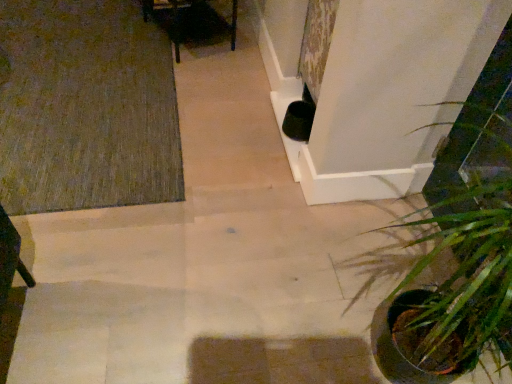
Where is `unoccupied region to the right of green textured rug at upper left`? The height and width of the screenshot is (384, 512). unoccupied region to the right of green textured rug at upper left is located at coordinates (245, 148).